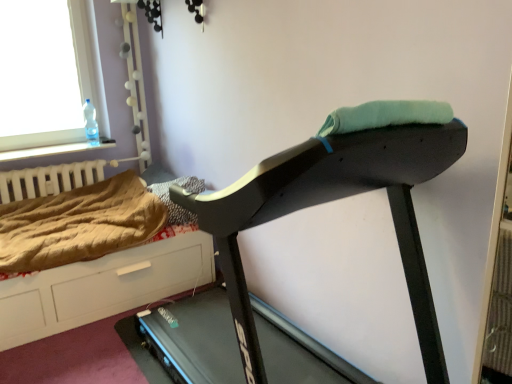
Locate an element on the screen. This screenshot has height=384, width=512. vacant area on top of white matte radiator at left (from a real-world perspective) is located at coordinates (74, 159).